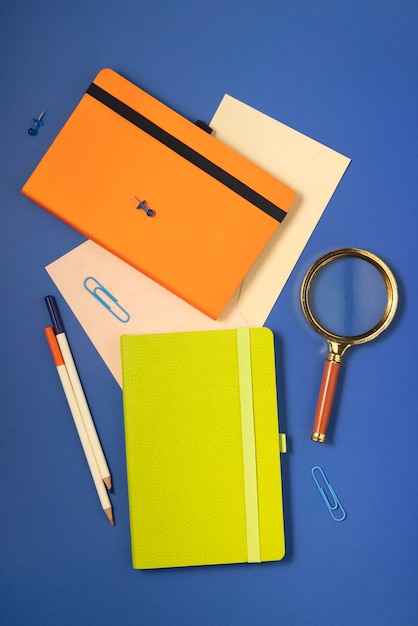
Where is `orange notebook`? Image resolution: width=418 pixels, height=626 pixels. orange notebook is located at coordinates (193, 242).